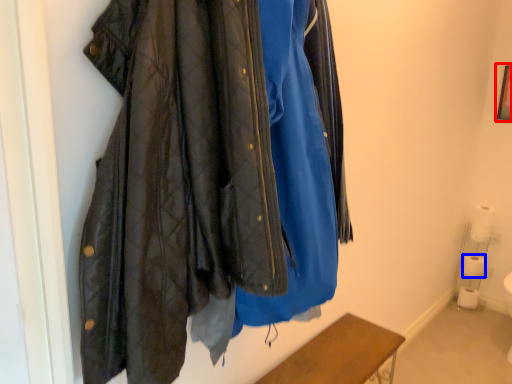
Question: Among these objects, which one is farthest to the camera, picture frame (highlighted by a red box) or toilet paper (highlighted by a blue box)?

Choices:
 (A) picture frame
 (B) toilet paper

Answer: (B)